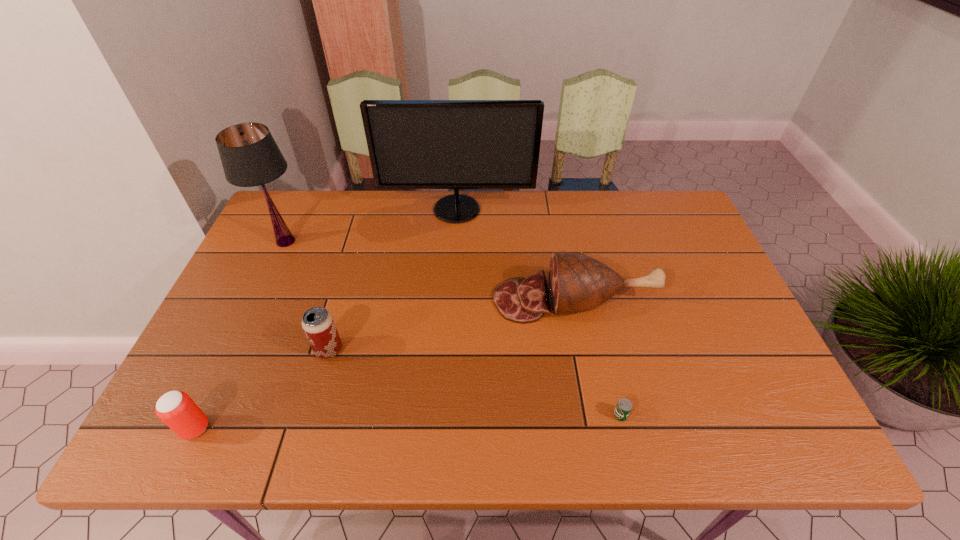
Locate an element on the screen. vacant point located between the second beer can from right to left and the lampshade is located at coordinates (307, 295).

Locate an element on the screen. Image resolution: width=960 pixels, height=540 pixels. vacant point located between the fourth nearest object and the lampshade is located at coordinates (430, 271).

Where is `free space that is in between the second beer can from right to left and the shortest object`? free space that is in between the second beer can from right to left and the shortest object is located at coordinates (474, 382).

At what (x,y) coordinates should I click in order to perform the action: click on unoccupied position between the shortest beer can and the lampshade. Please return your answer as a coordinate pair (x, y). Image resolution: width=960 pixels, height=540 pixels. Looking at the image, I should click on (453, 328).

Locate an element on the screen. The height and width of the screenshot is (540, 960). free spot between the second beer can from right to left and the shortest beer can is located at coordinates 474,382.

Where is `blank region between the second farthest object and the computer monitor`? This screenshot has height=540, width=960. blank region between the second farthest object and the computer monitor is located at coordinates (372, 226).

Find the location of a particular element. object that stands as the second closest to the second beer can from left to right is located at coordinates (250, 157).

Find the location of a particular element. Image resolution: width=960 pixels, height=540 pixels. object identified as the closest to the farthest object is located at coordinates (250, 157).

Locate which beer can is the second closest to the ham. Please provide its 2D coordinates. Your answer should be formatted as a tuple, i.e. [(x, y)], where the tuple contains the x and y coordinates of a point satisfying the conditions above.

[(318, 324)]

Locate an element on the screen. The image size is (960, 540). beer can that is the closest to the leftmost beer can is located at coordinates (318, 324).